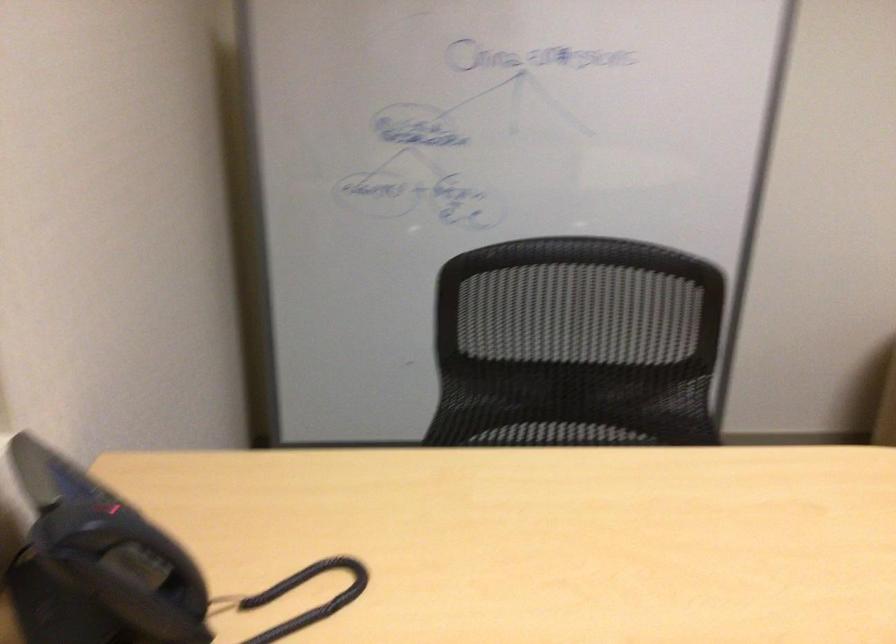
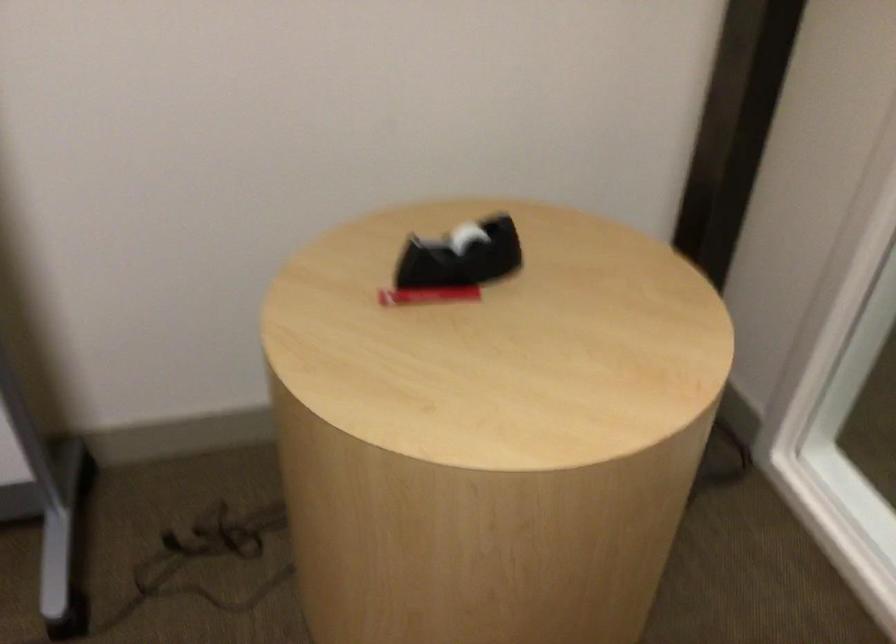
Which direction would the cameraman need to move to produce the second image?

The cameraman walked toward right, forward.